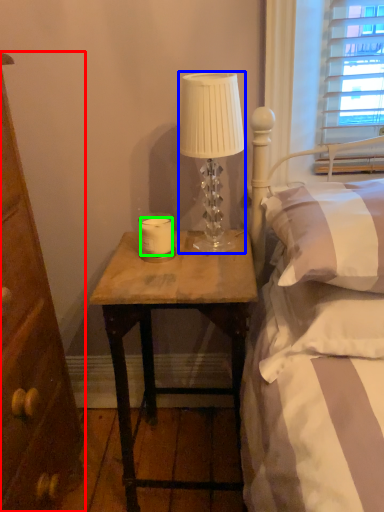
Question: Based on their relative distances, which object is nearer to cabinetry (highlighted by a red box)? Choose from lamp (highlighted by a blue box) and candle (highlighted by a green box).

Choices:
 (A) lamp
 (B) candle

Answer: (B)